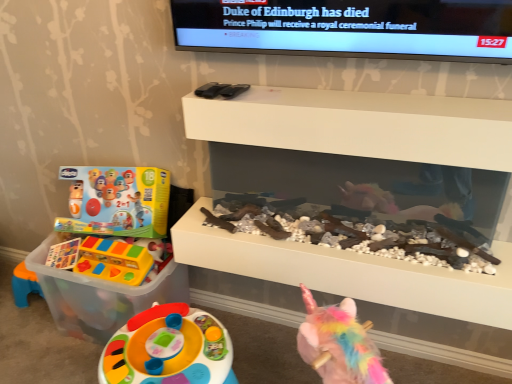
Question: Looking at their shapes, would you say white matte shelf at upper center, the first shelf from the top, is wider or thinner than matte plastic toy at left, the first toy when ordered from top to bottom?

Choices:
 (A) thin
 (B) wide

Answer: (A)

Question: Does point (184, 115) appear closer or farther from the camera than point (134, 244)?

Choices:
 (A) farther
 (B) closer

Answer: (B)

Question: Estimate the real-world distances between objects in this image. Which object is closer to the translucent plastic toy at left, the second toy when ordered from top to bottom?

Choices:
 (A) white matte fireplace at center, marked as the first shelf in a bottom-to-top arrangement
 (B) white matte shelf at upper center, the first shelf from the top
 (C) matte plastic toy at left, the second toy ordered from the bottom

Answer: (C)

Question: Which of these objects is positioned closest to the white matte shelf at upper center, the first shelf from the top?

Choices:
 (A) white matte fireplace at center, marked as the first shelf in a bottom-to-top arrangement
 (B) matte plastic toy at left, the second toy ordered from the bottom
 (C) translucent plastic toy at left, the second toy when ordered from top to bottom

Answer: (A)